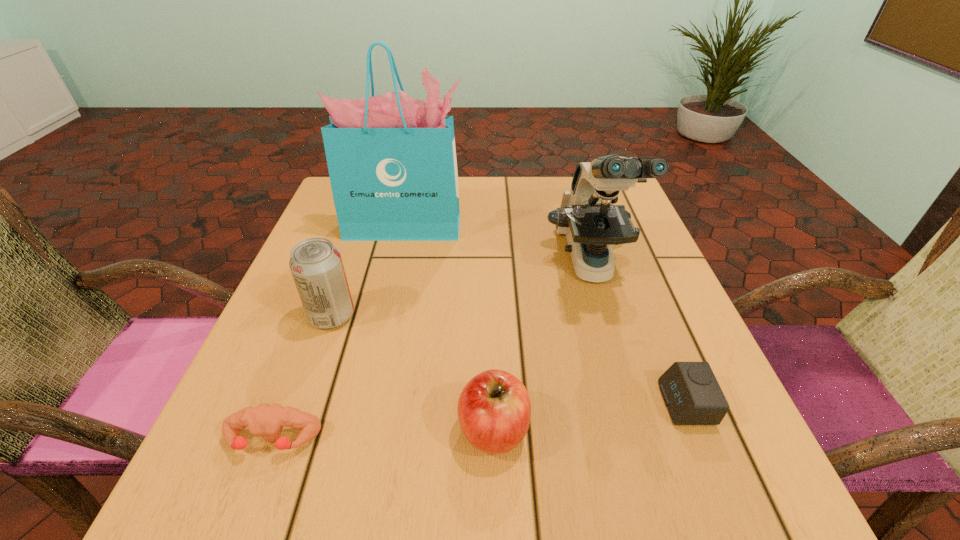
Where is `the tallest object`? Image resolution: width=960 pixels, height=540 pixels. the tallest object is located at coordinates (391, 158).

Image resolution: width=960 pixels, height=540 pixels. What are the coordinates of `microscope` in the screenshot? It's located at (592, 224).

Find the location of a particular element. This screenshot has height=540, width=960. soda can is located at coordinates (316, 265).

This screenshot has width=960, height=540. I want to click on the third object from right to left, so click(494, 410).

The height and width of the screenshot is (540, 960). Find the location of `apple`. apple is located at coordinates (494, 410).

This screenshot has height=540, width=960. Identify the location of alarm clock. (691, 392).

Identify the location of puncher. The height and width of the screenshot is (540, 960). (267, 420).

This screenshot has height=540, width=960. Identify the location of free space located on the front of the shopping bag. click(395, 276).

Where is `free spot located through the eyepieces of the microscope`? free spot located through the eyepieces of the microscope is located at coordinates (638, 428).

The width and height of the screenshot is (960, 540). In order to click on vacant region located on the back of the soda can in this screenshot , I will do `click(368, 214)`.